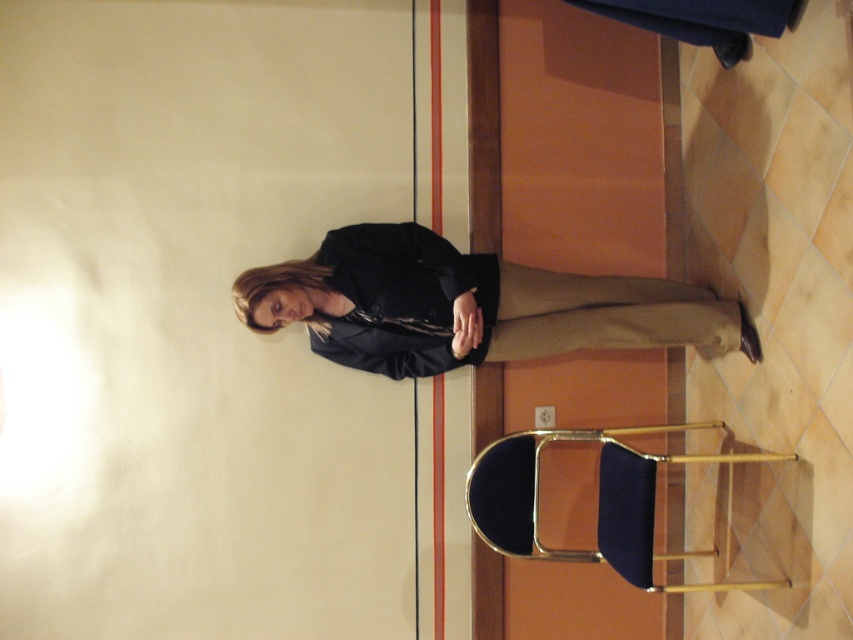
Question: Is matte black blazer at center positioned in front of velvet blue chair at lower right?

Choices:
 (A) no
 (B) yes

Answer: (A)

Question: Is matte black blazer at center to the left of velvet blue chair at lower right from the viewer's perspective?

Choices:
 (A) yes
 (B) no

Answer: (A)

Question: Can you confirm if matte black blazer at center is thinner than velvet blue chair at lower right?

Choices:
 (A) yes
 (B) no

Answer: (B)

Question: Which point is farther to the camera?

Choices:
 (A) (583, 435)
 (B) (619, 317)

Answer: (B)